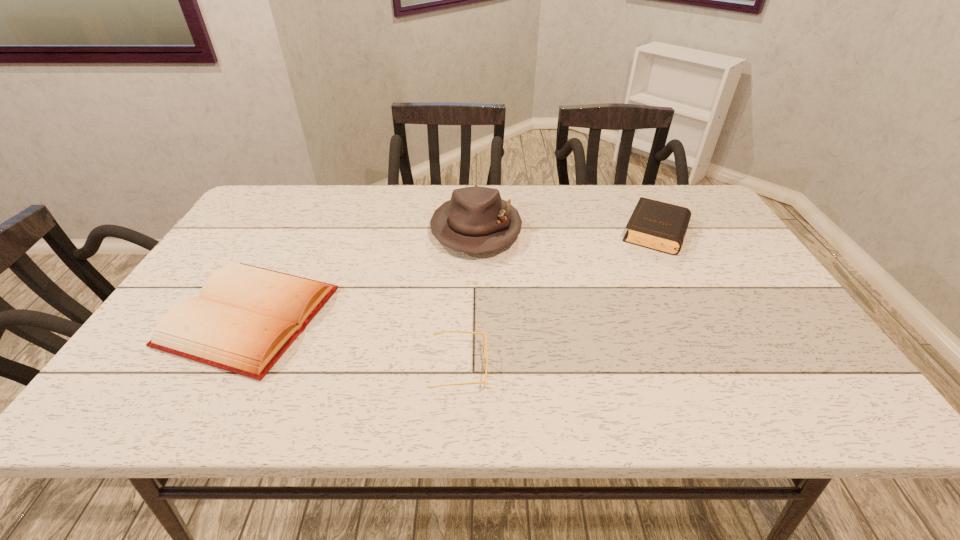
Image resolution: width=960 pixels, height=540 pixels. I want to click on hat at the far edge, so click(x=475, y=220).

Identify the location of Bible located in the far edge section of the desktop. This screenshot has width=960, height=540. (660, 226).

Image resolution: width=960 pixels, height=540 pixels. Identify the location of Bible that is at the near edge. (245, 318).

The height and width of the screenshot is (540, 960). Identify the location of spectacles that is positioned at the near edge. (484, 337).

Locate an element on the screen. This screenshot has height=540, width=960. object that is at the left edge is located at coordinates (245, 318).

Identify the location of object present at the right edge. (660, 226).

Where is `object present at the near left corner`? Image resolution: width=960 pixels, height=540 pixels. object present at the near left corner is located at coordinates (245, 318).

Identify the location of object present at the far right corner. This screenshot has width=960, height=540. (660, 226).

At what (x,y) coordinates should I click in order to perform the action: click on free space at the far edge of the desktop. Please return your answer as a coordinate pair (x, y). Looking at the image, I should click on (554, 187).

In the image, there is a desktop. Identify the location of blank space at the near edge. (401, 398).